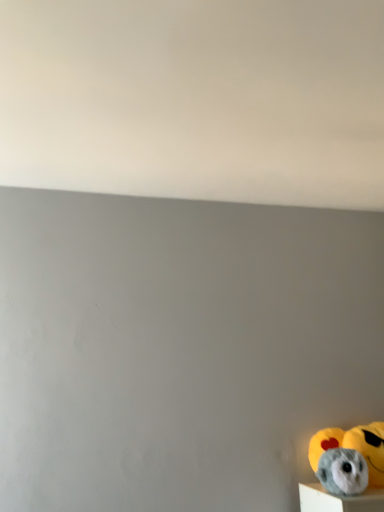
Question: Visually, is fluffy gray plush toy at lower right positioned to the left or to the right of fluffy gray plush toy at lower right?

Choices:
 (A) right
 (B) left

Answer: (B)

Question: Is fluffy gray plush toy at lower right taller or shorter than fluffy gray plush toy at lower right?

Choices:
 (A) short
 (B) tall

Answer: (A)

Question: In the image, is fluffy gray plush toy at lower right positioned in front of or behind fluffy gray plush toy at lower right?

Choices:
 (A) front
 (B) behind

Answer: (A)

Question: Based on their sizes in the image, would you say fluffy gray plush toy at lower right is bigger or smaller than fluffy gray plush toy at lower right?

Choices:
 (A) small
 (B) big

Answer: (B)

Question: From a real-world perspective, relative to fluffy gray plush toy at lower right, is fluffy gray plush toy at lower right vertically above or below?

Choices:
 (A) below
 (B) above

Answer: (B)

Question: Is fluffy gray plush toy at lower right inside or outside of fluffy gray plush toy at lower right?

Choices:
 (A) inside
 (B) outside

Answer: (B)

Question: Is point (372, 458) closer or farther from the camera than point (345, 468)?

Choices:
 (A) farther
 (B) closer

Answer: (A)